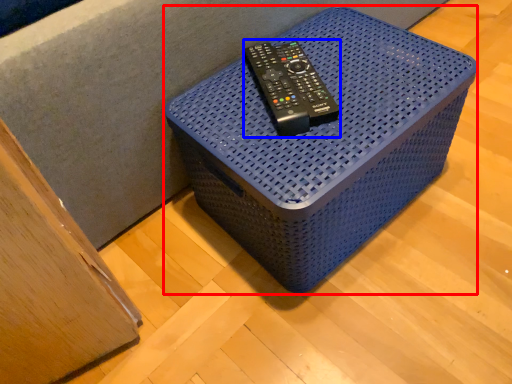
Question: Which point is further to the camera, furniture (highlighted by a red box) or equipment (highlighted by a blue box)?

Choices:
 (A) furniture
 (B) equipment

Answer: (B)